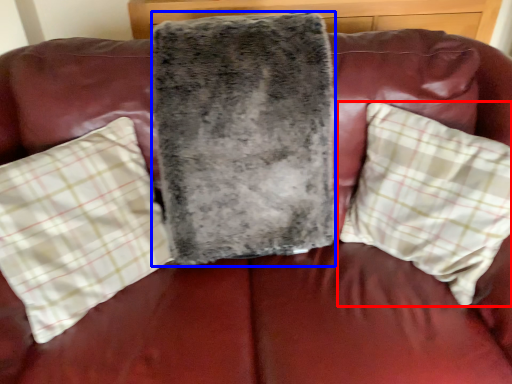
Question: Which of the following is the farthest to the observer, pillow (highlighted by a red box) or blanket (highlighted by a blue box)?

Choices:
 (A) pillow
 (B) blanket

Answer: (B)